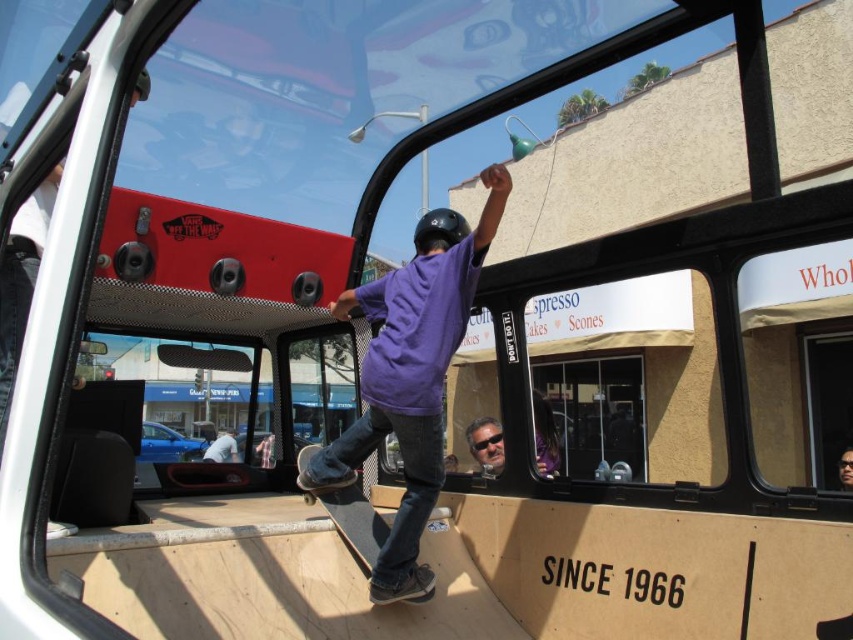
Find the location of a particular element. The image size is (853, 640). wooden skateboard at center is located at coordinates (339, 502).

Which of these two, wooden skateboard at center or gray textured hair at center, stands taller?

wooden skateboard at center

Between point (305, 451) and point (486, 436), which one is positioned in front?

Point (305, 451) is more forward.

Locate an element on the screen. This screenshot has height=640, width=853. wooden skateboard at center is located at coordinates (339, 502).

What do you see at coordinates (410, 378) in the screenshot?
I see `purple matte skateboard at center` at bounding box center [410, 378].

Based on the photo, is the position of purple matte skateboard at center more distant than that of light blue jeans at lower center?

No, it is in front of light blue jeans at lower center.

Who is more forward, (427,342) or (210,444)?

Point (427,342) is more forward.

Locate an element on the screen. The height and width of the screenshot is (640, 853). purple matte skateboard at center is located at coordinates (410, 378).

Is gray textured hair at center bigger than light blue jeans at lower center?

No.

Where is `gray textured hair at center`? The width and height of the screenshot is (853, 640). gray textured hair at center is located at coordinates (485, 445).

Is point (463, 433) positioned after point (225, 440)?

Yes, point (463, 433) is behind point (225, 440).

What are the coordinates of `gray textured hair at center` in the screenshot? It's located at (485, 445).